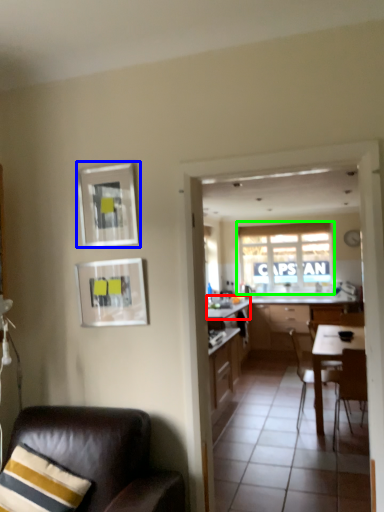
Question: Which object is the closest to the counter top (highlighted by a red box)? Choose among these: picture frame (highlighted by a blue box) or window (highlighted by a green box).

Choices:
 (A) picture frame
 (B) window

Answer: (B)